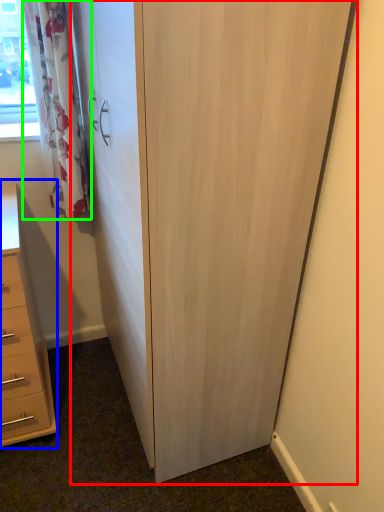
Question: Which object is positioned farthest from cupboard (highlighted by a red box)? Select from chest of drawers (highlighted by a blue box) and curtain (highlighted by a green box).

Choices:
 (A) chest of drawers
 (B) curtain

Answer: (A)